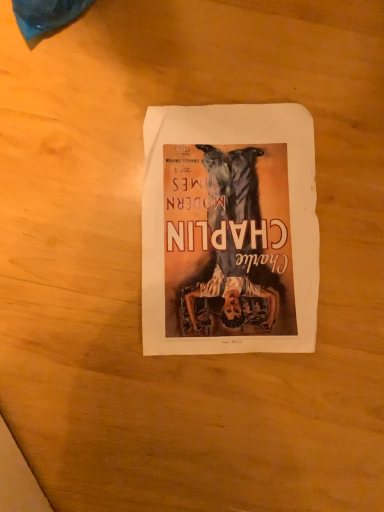
At what (x,y) coordinates should I click in order to perform the action: click on matte paper poster at center. Please return your answer as a coordinate pair (x, y). The image size is (384, 512). Looking at the image, I should click on (229, 230).

Describe the element at coordinates (229, 230) in the screenshot. Image resolution: width=384 pixels, height=512 pixels. I see `matte paper poster at center` at that location.

Identify the location of matte paper poster at center. Image resolution: width=384 pixels, height=512 pixels. (229, 230).